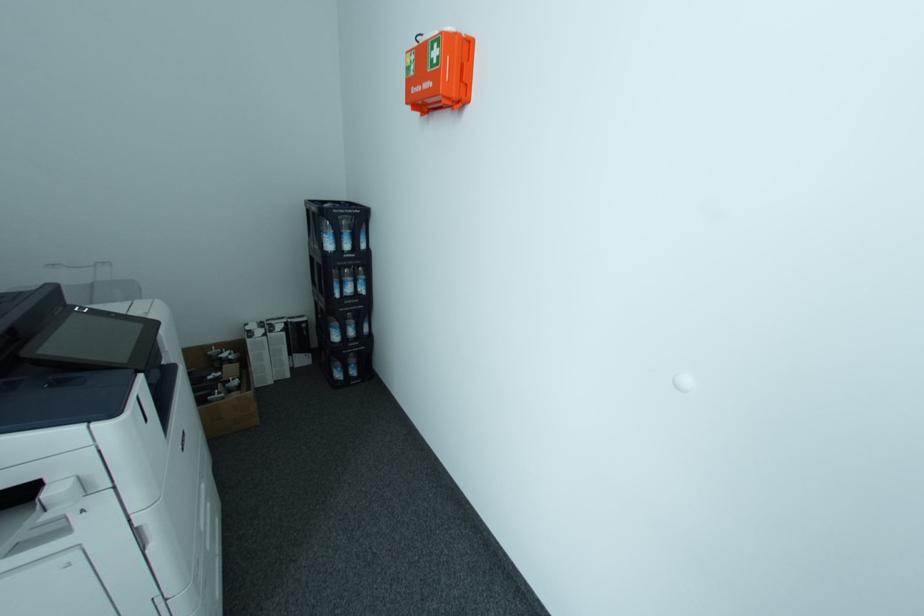
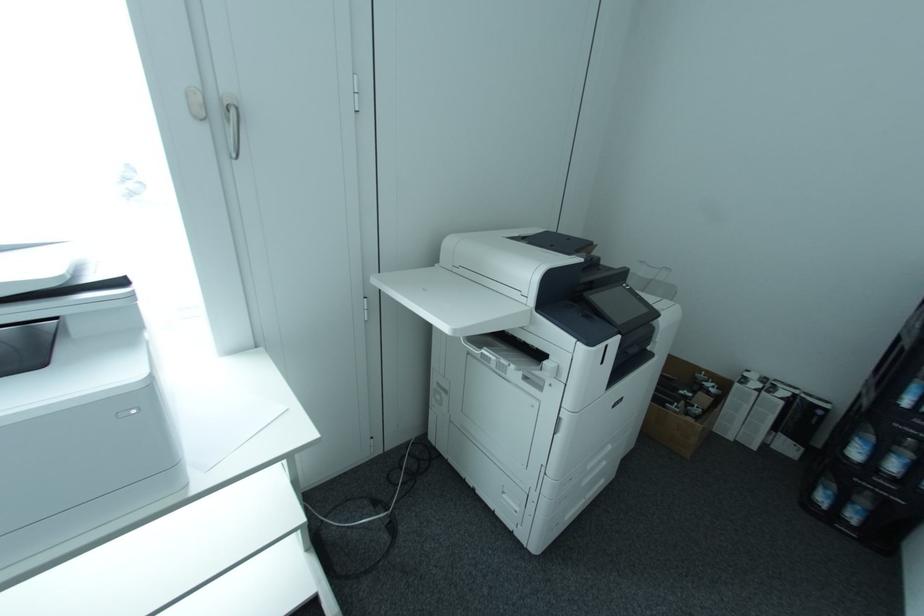
Question: The camera is either moving clockwise (left) or counter-clockwise (right) around the object. The first image is from the beginning of the video and the second image is from the end. Is the camera moving left or right when shooting the video?

Choices:
 (A) Left
 (B) Right

Answer: (B)